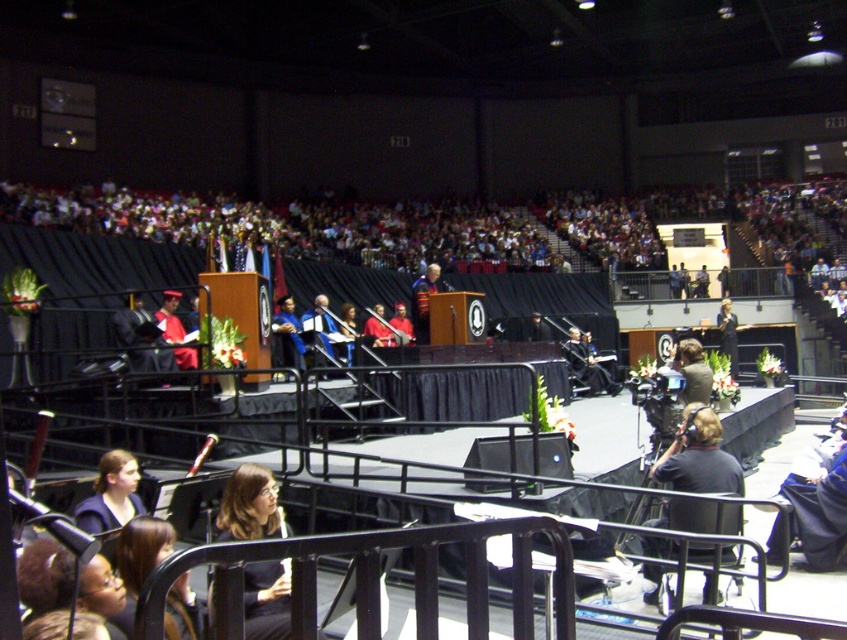
You are a photographer at the graduation ceremony. You need to capture a photo that includes both the dark brown hair at lower left and the knitted sweater at center. Which object should you adjust your camera angle to focus on first to ensure both are in frame?

The dark brown hair at lower left is taller than the knitted sweater at center, so you should focus on the dark brown hair at lower left first to ensure both are in frame.

You are a photographer at the graduation ceremony. You notice the black fabric camera at lower right and the dark brown hair at lower left. Which object is positioned to the right side of the other?

The black fabric camera at lower right is positioned to the right of dark brown hair at lower left.